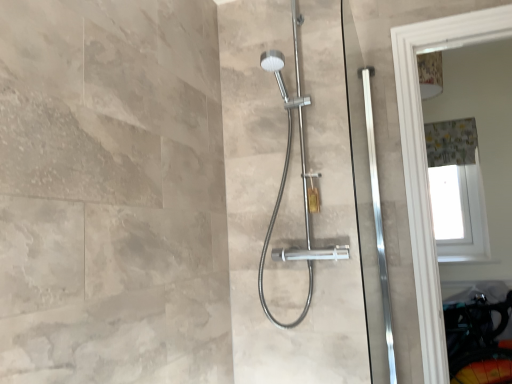
Question: From the image's perspective, is gray fabric shower curtain at upper right above or below satin nickel shower head at center?

Choices:
 (A) below
 (B) above

Answer: (B)

Question: In terms of height, does gray fabric shower curtain at upper right look taller or shorter compared to satin nickel shower head at center?

Choices:
 (A) tall
 (B) short

Answer: (B)

Question: From a real-world perspective, is gray fabric shower curtain at upper right positioned above or below satin nickel shower head at center?

Choices:
 (A) below
 (B) above

Answer: (B)

Question: Would you say satin nickel shower head at center is to the left or to the right of gray fabric shower curtain at upper right in the picture?

Choices:
 (A) left
 (B) right

Answer: (A)

Question: In terms of size, does satin nickel shower head at center appear bigger or smaller than gray fabric shower curtain at upper right?

Choices:
 (A) big
 (B) small

Answer: (A)

Question: Considering the positions of satin nickel shower head at center and gray fabric shower curtain at upper right in the image, is satin nickel shower head at center taller or shorter than gray fabric shower curtain at upper right?

Choices:
 (A) short
 (B) tall

Answer: (B)

Question: From a real-world perspective, is satin nickel shower head at center physically located above or below gray fabric shower curtain at upper right?

Choices:
 (A) above
 (B) below

Answer: (B)